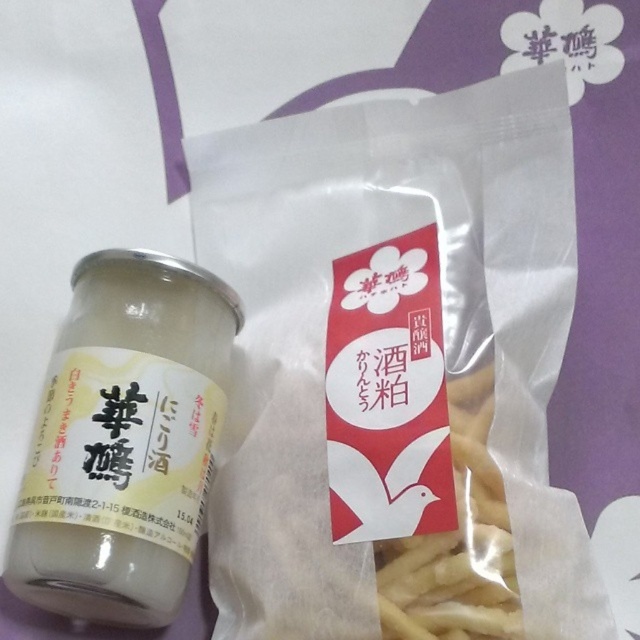
You are a delivery person who needs to place both the translucent glass jar at center and the yellow matte french fries at center into a box. The box has a front panel that you want to keep visible. Which item should you place closer to the front of the box to ensure its label remains visible?

The translucent glass jar at center should be placed closer to the front of the box because the yellow matte french fries at center is behind it, meaning the jar is in front and its label would be more visible.

You are a delivery person who needs to place the translucent glass jar at center and the yellow matte french fries at center into a box. The box has limited vertical space. Which item should you place at the bottom to ensure both fit vertically?

The yellow matte french fries at center should be placed at the bottom because the translucent glass jar at center is located above it, indicating it might be taller or occupies more vertical space.

You are standing in front of the image and want to touch the two points labeled as point (88, 449) and point (461, 596). Which point do you need to reach further back to touch?

Point (88, 449) is behind point (461, 596), so you need to reach further back to touch point (88, 449).